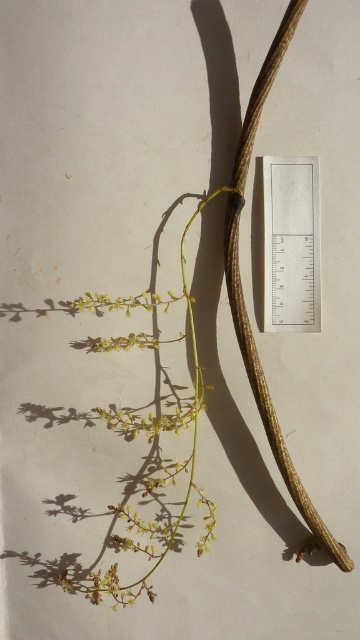
Question: Is white paper ruler at upper center smaller than brown rough branch at center?

Choices:
 (A) yes
 (B) no

Answer: (A)

Question: Which point appears closest to the camera in this image?

Choices:
 (A) (275, 56)
 (B) (272, 317)

Answer: (A)

Question: In this image, where is white paper ruler at upper center located relative to brown rough branch at center?

Choices:
 (A) right
 (B) left

Answer: (A)

Question: Which point is farther to the camera?

Choices:
 (A) brown rough branch at center
 (B) white paper ruler at upper center

Answer: (B)

Question: Is white paper ruler at upper center to the left of brown rough branch at center from the viewer's perspective?

Choices:
 (A) no
 (B) yes

Answer: (A)